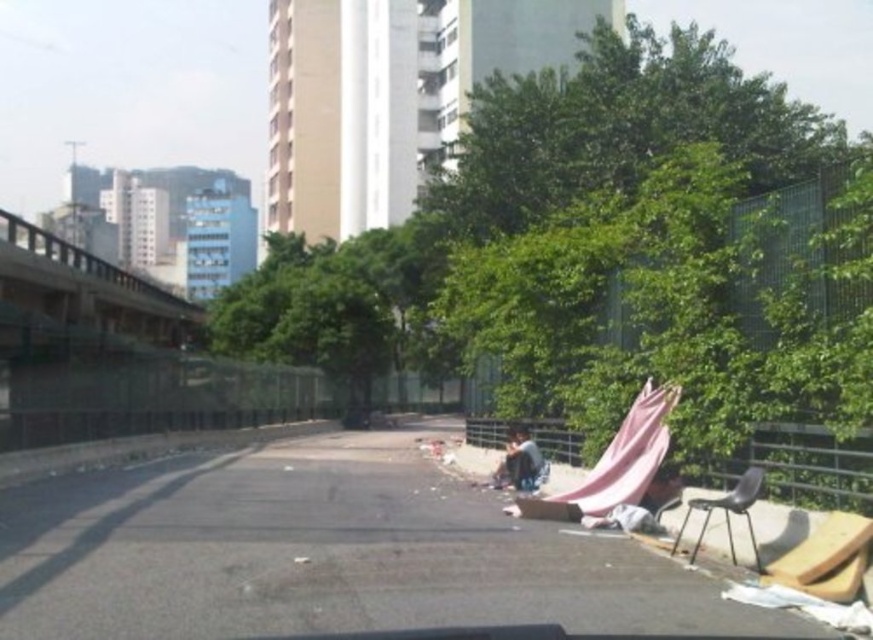
You are standing at point [88,288] in the urban scene. What object is located exactly at your current position?

The brushed metal overpass at upper left is located exactly at point [88,288].

You are standing at the point closer to the camera between the two points, point (25, 262) and point (730, 490). Which point are you standing at?

You are standing at point (25, 262) because it is closer to the camera than point (730, 490).